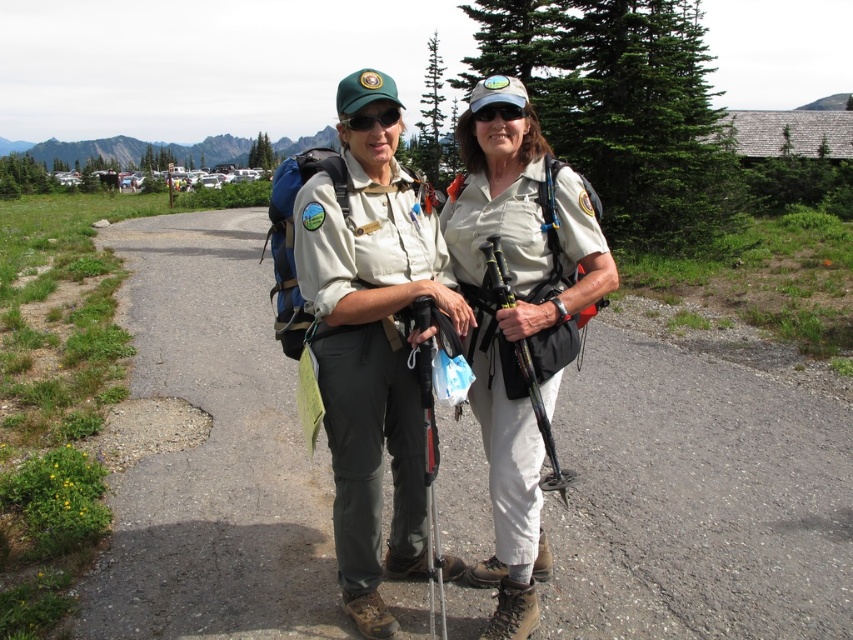
Does point (523, 307) lie behind point (492, 294)?

No.

Between khaki uniform at center and black rubber ski pole at center, which one appears on the right side from the viewer's perspective?

From the viewer's perspective, black rubber ski pole at center appears more on the right side.

Measure the distance between point (541, 564) and camera.

3.36 meters

The image size is (853, 640). What are the coordinates of `khaki uniform at center` in the screenshot? It's located at (375, 243).

Which of these two, metallic silver ski pole at center or matte black goggles at center, stands taller?

With more height is metallic silver ski pole at center.

Does point (433, 470) come in front of point (503, 118)?

Yes, point (433, 470) is closer to viewer.

Describe the element at coordinates (430, 481) in the screenshot. I see `metallic silver ski pole at center` at that location.

Image resolution: width=853 pixels, height=640 pixels. Identify the location of metallic silver ski pole at center. (430, 481).

From the picture: Which of these two, khaki uniform at center or metallic silver ski pole at center, stands shorter?

With less height is metallic silver ski pole at center.

Consider the image. Which of these two, khaki uniform at center or metallic silver ski pole at center, stands taller?

With more height is khaki uniform at center.

Between point (372, 234) and point (445, 625), which one is positioned in front?

Point (372, 234) is in front.

Locate an element on the screen. This screenshot has height=640, width=853. khaki uniform at center is located at coordinates pyautogui.click(x=375, y=243).